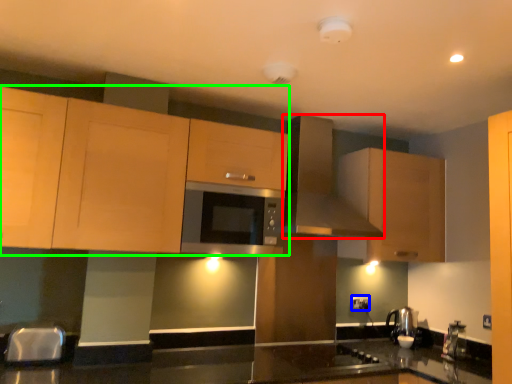
Question: Considering the real-world distances, which object is closest to kitchen appliance (highlighted by a red box)? electric outlet (highlighted by a blue box) or cabinetry (highlighted by a green box).

Choices:
 (A) electric outlet
 (B) cabinetry

Answer: (B)